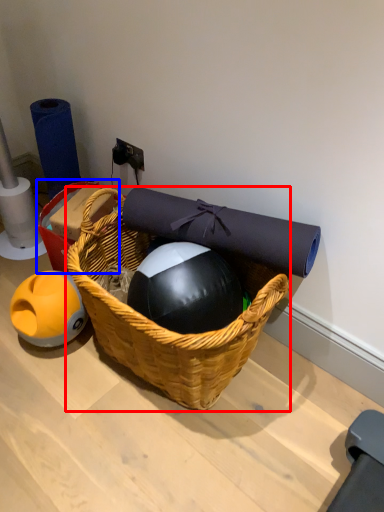
Question: Which point is closer to the camera, picnic basket (highlighted by a red box) or basket (highlighted by a blue box)?

Choices:
 (A) picnic basket
 (B) basket

Answer: (A)